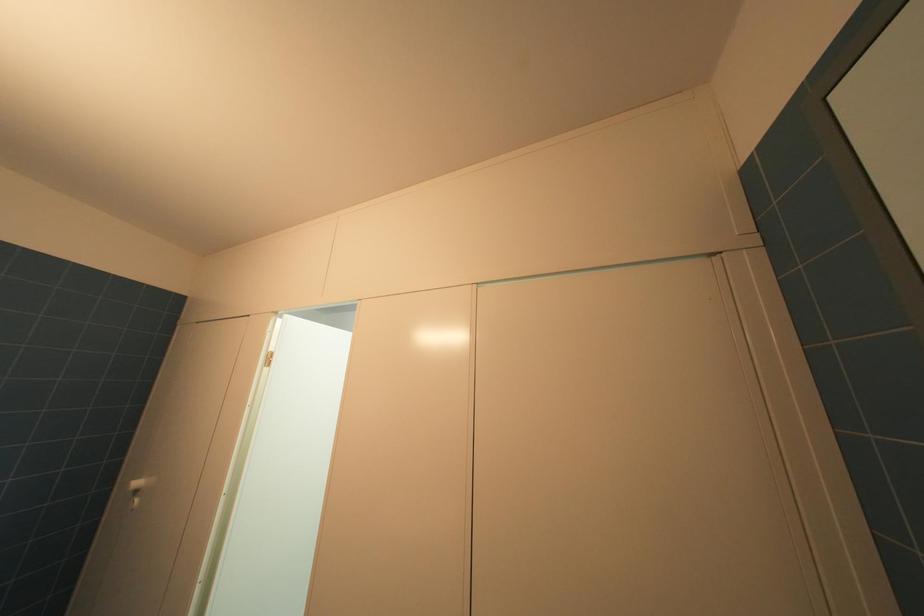
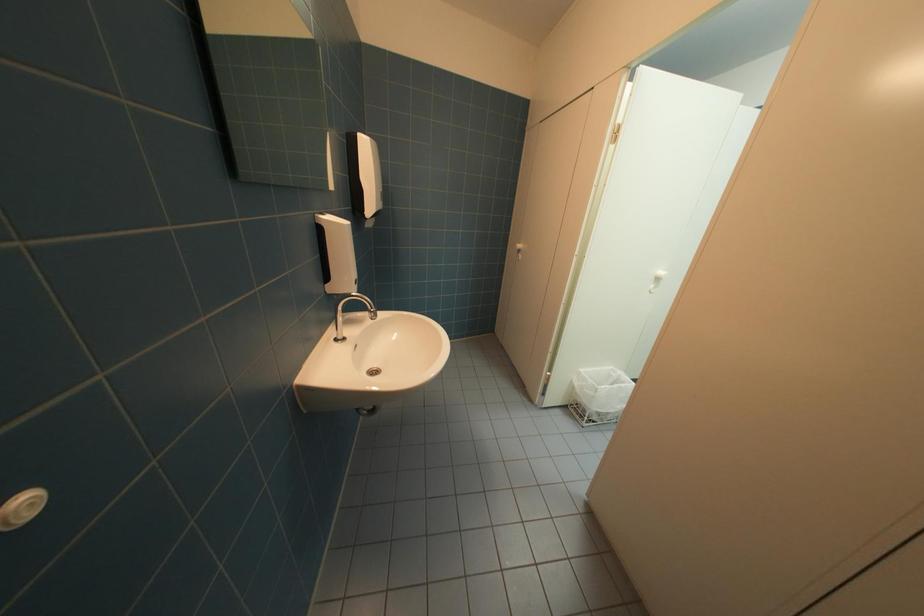
The images are taken continuously from a first-person perspective. In which direction is your viewpoint rotating?

The camera rotated toward left-down.